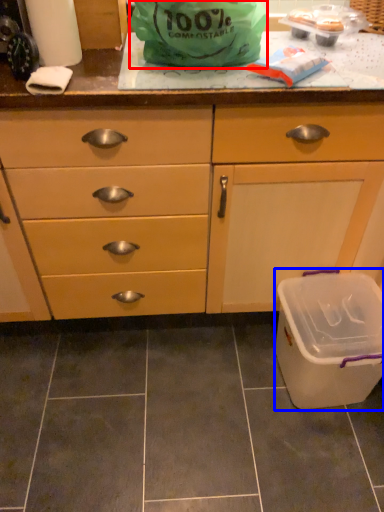
Question: Which point is closer to the camera, plastic bag (highlighted by a red box) or recycling bin (highlighted by a blue box)?

Choices:
 (A) plastic bag
 (B) recycling bin

Answer: (A)